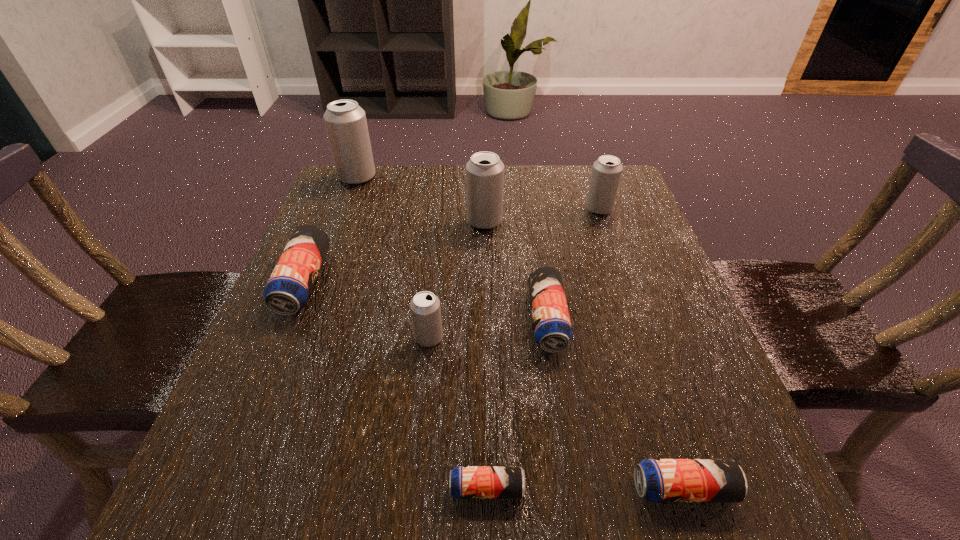
In the image, there is a desktop. Where is `free space at the right edge`? The height and width of the screenshot is (540, 960). free space at the right edge is located at coordinates point(706,441).

Where is `vacant space at the far left corner`? The height and width of the screenshot is (540, 960). vacant space at the far left corner is located at coordinates (320, 207).

In the image, there is a desktop. Where is `vacant space at the far right corner`? vacant space at the far right corner is located at coordinates (581, 213).

Find the location of a particular element. The image size is (960, 540). free area in between the seventh shortest object and the rightmost blue beer can is located at coordinates (584, 355).

Find the location of `free space between the second tallest object and the leftmost blue beer can`. free space between the second tallest object and the leftmost blue beer can is located at coordinates (395, 252).

The width and height of the screenshot is (960, 540). What are the coordinates of `vacant area between the leftmost blue beer can and the third biggest white beer can` in the screenshot? It's located at (451, 245).

You are a GUI agent. You are given a task and a screenshot of the screen. Output one action in this format:
    pyautogui.click(x=<x>, y=<y>)
    Task: Click on the free space between the seventh shortest object and the third biggest blue beer can
    
    Given the screenshot: What is the action you would take?
    pyautogui.click(x=584, y=355)

Identify the location of free point between the leftmost white beer can and the fourth shortest beer can. The width and height of the screenshot is (960, 540). (330, 230).

Locate an element on the screen. The image size is (960, 540). vacant space that's between the fourth shortest beer can and the sixth shortest object is located at coordinates (451, 245).

In order to click on vacant area that lies between the leftmost blue beer can and the third smallest white beer can in this screenshot , I will do `click(395, 252)`.